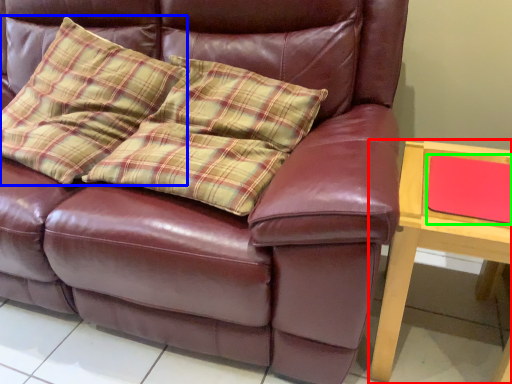
Question: Based on their relative distances, which object is nearer to table (highlighted by a red box)? Choose from throw pillow (highlighted by a blue box) and pad (highlighted by a green box).

Choices:
 (A) throw pillow
 (B) pad

Answer: (B)